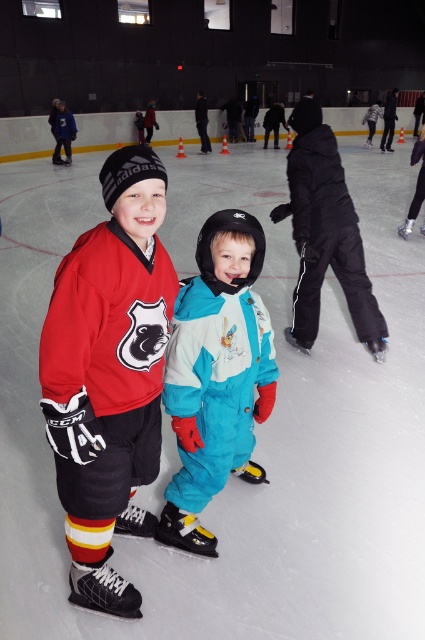
Which is above, matte red hockey jersey at center or teal snowsuit at center?

teal snowsuit at center is above.

Can you confirm if matte red hockey jersey at center is positioned to the left of teal snowsuit at center?

Yes, matte red hockey jersey at center is to the left of teal snowsuit at center.

Find the location of `matte red hockey jersey at center`. matte red hockey jersey at center is located at coordinates (108, 374).

Measure the distance between point (116,228) and camera.

1.59 meters

Is point (87, 513) farther from camera compared to point (299, 339)?

That is False.

Identify the location of matte red hockey jersey at center. The height and width of the screenshot is (640, 425). (108, 374).

Who is more distant from viewer, (269, 381) or (294, 202)?

The point (294, 202) is more distant.

Can you confirm if teal snowsuit at center is positioned to the left of black matte snowsuit at center?

Correct, you'll find teal snowsuit at center to the left of black matte snowsuit at center.

Does point (238, 323) come farther from viewer compared to point (374, 355)?

No.

This screenshot has width=425, height=640. I want to click on teal snowsuit at center, so click(x=215, y=376).